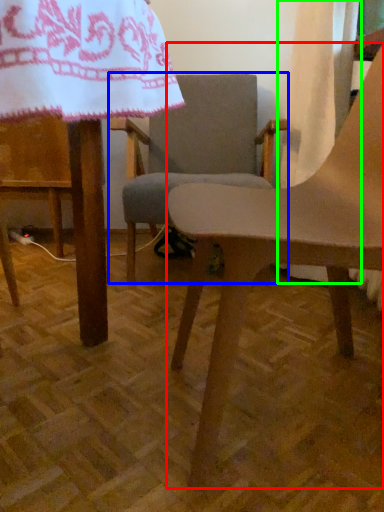
Question: Which object is positioned farthest from chair (highlighted by a red box)? Select from chair (highlighted by a blue box) and curtain (highlighted by a green box).

Choices:
 (A) chair
 (B) curtain

Answer: (A)